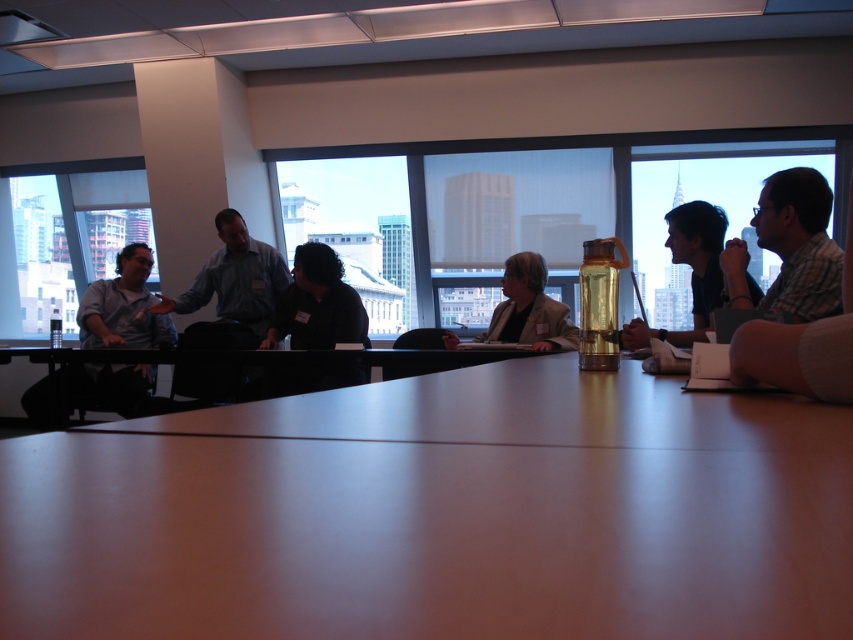
Does plaid shirt at right have a greater width compared to translucent plastic bottle at center?

Yes.

Does point (773, 224) lie in front of point (589, 285)?

No, (773, 224) is behind (589, 285).

I want to click on plaid shirt at right, so click(788, 248).

Can you confirm if dark gray shirt at center is thinner than translucent plastic water bottle at center?

Incorrect, dark gray shirt at center's width is not less than translucent plastic water bottle at center's.

Who is positioned more to the left, dark gray shirt at center or translucent plastic water bottle at center?

dark gray shirt at center is more to the left.

Between point (277, 307) and point (543, 342), which one is positioned behind?

Point (277, 307)

Where is `dark gray shirt at center`? This screenshot has width=853, height=640. dark gray shirt at center is located at coordinates (317, 304).

Based on the photo, which of these two, plaid shirt at right or translucent plastic water bottle at upper right, stands taller?

Standing taller between the two is translucent plastic water bottle at upper right.

Is plaid shirt at right to the left of translucent plastic water bottle at upper right from the viewer's perspective?

Incorrect, plaid shirt at right is not on the left side of translucent plastic water bottle at upper right.

Locate an element on the screen. plaid shirt at right is located at coordinates (788, 248).